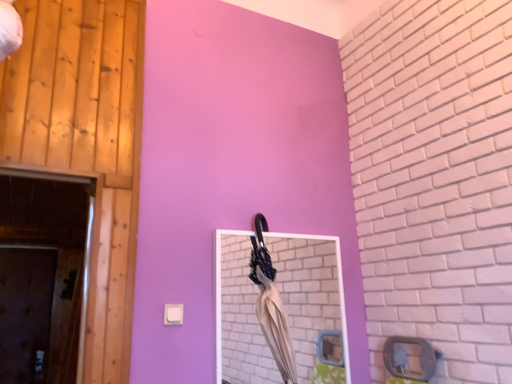
Question: Is beige fabric umbrella at center thinner than brown matte door at lower left, the second door viewed from the front?

Choices:
 (A) no
 (B) yes

Answer: (A)

Question: Does beige fabric umbrella at center come behind brown matte door at lower left, the first door when ordered from bottom to top?

Choices:
 (A) yes
 (B) no

Answer: (B)

Question: Can you confirm if beige fabric umbrella at center is smaller than brown matte door at lower left, the first door when ordered from bottom to top?

Choices:
 (A) yes
 (B) no

Answer: (A)

Question: Is beige fabric umbrella at center positioned beyond the bounds of brown matte door at lower left, which ranks as the 1th door in left-to-right order?

Choices:
 (A) no
 (B) yes

Answer: (B)

Question: From a real-world perspective, is beige fabric umbrella at center physically below brown matte door at lower left, the second door from the top?

Choices:
 (A) no
 (B) yes

Answer: (A)

Question: From a real-world perspective, is beige fabric umbrella at center physically above brown matte door at lower left, which is counted as the first door, starting from the back?

Choices:
 (A) yes
 (B) no

Answer: (A)

Question: Considering the relative positions of wooden at left, the 1th door when ordered from top to bottom, and brown matte door at lower left, which ranks as the 1th door in left-to-right order, in the image provided, is wooden at left, the 1th door when ordered from top to bottom, to the left of brown matte door at lower left, which ranks as the 1th door in left-to-right order, from the viewer's perspective?

Choices:
 (A) no
 (B) yes

Answer: (A)

Question: From a real-world perspective, does wooden at left, arranged as the second door when viewed from the back, stand above brown matte door at lower left, the first door when ordered from bottom to top?

Choices:
 (A) yes
 (B) no

Answer: (A)

Question: Is wooden at left, which ranks as the second door in bottom-to-top order, shorter than brown matte door at lower left, the first door when ordered from bottom to top?

Choices:
 (A) yes
 (B) no

Answer: (B)

Question: Considering the relative sizes of wooden at left, the first door positioned from the front, and brown matte door at lower left, the first door when ordered from bottom to top, in the image provided, is wooden at left, the first door positioned from the front, smaller than brown matte door at lower left, the first door when ordered from bottom to top,?

Choices:
 (A) yes
 (B) no

Answer: (A)

Question: Is wooden at left, the 1th door when ordered from top to bottom, in front of brown matte door at lower left, which is counted as the first door, starting from the back?

Choices:
 (A) no
 (B) yes

Answer: (B)

Question: Is wooden at left, marked as the second door in a left-to-right arrangement, wider than brown matte door at lower left, which ranks as the 1th door in left-to-right order?

Choices:
 (A) yes
 (B) no

Answer: (B)

Question: Is matte white mirror at center taller than wooden at left, marked as the second door in a left-to-right arrangement?

Choices:
 (A) yes
 (B) no

Answer: (B)